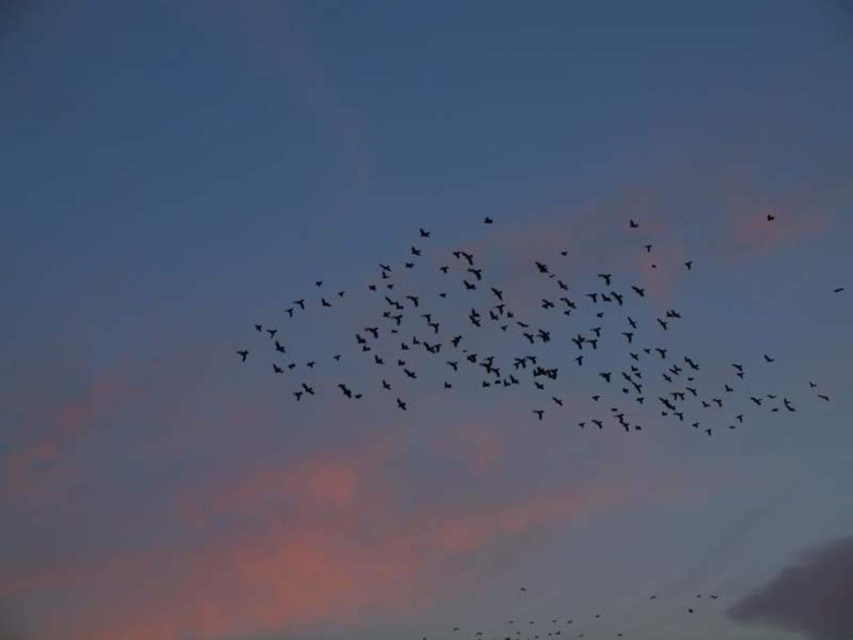
Looking at the twilight sky scene, where are the black matte birds at center in relation to the gray matte cloud at lower right?

The black matte birds at center are positioned to the left of the gray matte cloud at lower right.

You are a drone operator trying to capture a photo of the black matte bird at upper right and the gray matte cloud at lower right in the same frame. The drone can only focus on objects within 100 feet of each other. Will you be able to capture both in focus?

The gray matte cloud at lower right and black matte bird at upper right are 125.82 feet apart from each other. Since the distance exceeds the 100 feet limit, the drone cannot focus on both objects simultaneously.